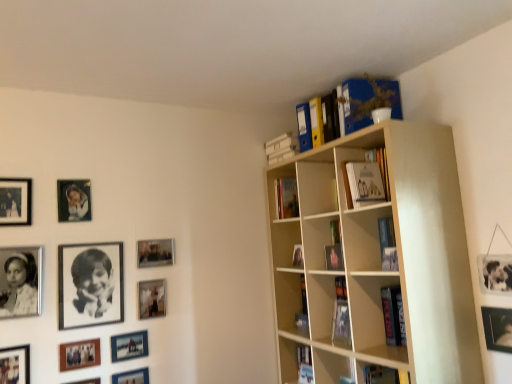
Question: From the image's perspective, does metallic silver photo frame at lower left, placed as the 9th picture frame when sorted from left to right, appear higher than beige wood bookcase at upper right?

Choices:
 (A) yes
 (B) no

Answer: (B)

Question: Is metallic silver photo frame at lower left, placed as the 9th picture frame when sorted from left to right, oriented towards beige wood bookcase at upper right?

Choices:
 (A) no
 (B) yes

Answer: (A)

Question: Considering the relative sizes of metallic silver photo frame at lower left, marked as the fourth picture frame in a right-to-left arrangement, and beige wood bookcase at upper right in the image provided, is metallic silver photo frame at lower left, marked as the fourth picture frame in a right-to-left arrangement, taller than beige wood bookcase at upper right?

Choices:
 (A) no
 (B) yes

Answer: (A)

Question: Considering the relative sizes of metallic silver photo frame at lower left, placed as the 9th picture frame when sorted from left to right, and beige wood bookcase at upper right in the image provided, is metallic silver photo frame at lower left, placed as the 9th picture frame when sorted from left to right, smaller than beige wood bookcase at upper right?

Choices:
 (A) no
 (B) yes

Answer: (B)

Question: From a real-world perspective, is metallic silver photo frame at lower left, placed as the 9th picture frame when sorted from left to right, under beige wood bookcase at upper right?

Choices:
 (A) no
 (B) yes

Answer: (B)

Question: Is metallic silver photo frame at lower left, placed as the 9th picture frame when sorted from left to right, far away from beige wood bookcase at upper right?

Choices:
 (A) no
 (B) yes

Answer: (B)

Question: Are metallic silver picture frame at upper right, acting as the first picture frame starting from the right, and beige wood bookcase at upper right beside each other?

Choices:
 (A) no
 (B) yes

Answer: (A)

Question: Is metallic silver picture frame at upper right, which ranks as the 12th picture frame in left-to-right order, positioned far away from beige wood bookcase at upper right?

Choices:
 (A) no
 (B) yes

Answer: (A)

Question: Is metallic silver picture frame at upper right, which ranks as the 12th picture frame in left-to-right order, taller than beige wood bookcase at upper right?

Choices:
 (A) no
 (B) yes

Answer: (A)

Question: Could beige wood bookcase at upper right be considered to be inside metallic silver picture frame at upper right, which ranks as the 12th picture frame in left-to-right order?

Choices:
 (A) no
 (B) yes

Answer: (A)

Question: Can you confirm if metallic silver picture frame at upper right, which ranks as the 12th picture frame in left-to-right order, is positioned to the left of beige wood bookcase at upper right?

Choices:
 (A) yes
 (B) no

Answer: (B)

Question: Does metallic silver picture frame at upper right, acting as the first picture frame starting from the right, have a smaller size compared to beige wood bookcase at upper right?

Choices:
 (A) yes
 (B) no

Answer: (A)

Question: Does blue cardboard file at upper right have a greater width compared to matte black picture frame at center-left, the 2th picture frame viewed from the right?

Choices:
 (A) yes
 (B) no

Answer: (A)